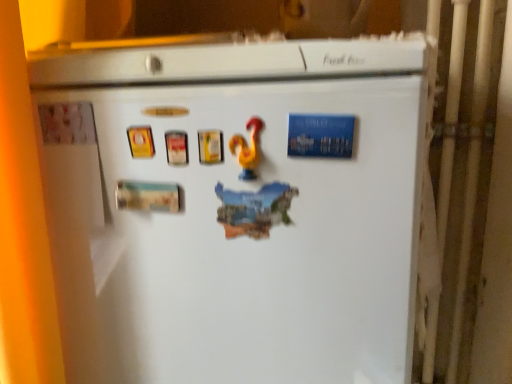
Question: Can you confirm if yellow rubber duck at center is wider than white matte refrigerator at center?

Choices:
 (A) yes
 (B) no

Answer: (B)

Question: Is yellow rubber duck at center facing towards white matte refrigerator at center?

Choices:
 (A) no
 (B) yes

Answer: (B)

Question: Can you see yellow rubber duck at center touching white matte refrigerator at center?

Choices:
 (A) yes
 (B) no

Answer: (B)

Question: Is yellow rubber duck at center positioned before white matte refrigerator at center?

Choices:
 (A) no
 (B) yes

Answer: (A)

Question: Is yellow rubber duck at center to the left of white matte refrigerator at center from the viewer's perspective?

Choices:
 (A) no
 (B) yes

Answer: (A)

Question: From the image's perspective, is yellow rubber duck at center located above white matte refrigerator at center?

Choices:
 (A) no
 (B) yes

Answer: (B)

Question: Is white matte refrigerator at center behind yellow rubber duck at center?

Choices:
 (A) no
 (B) yes

Answer: (A)

Question: From the image's perspective, is white matte refrigerator at center beneath yellow rubber duck at center?

Choices:
 (A) yes
 (B) no

Answer: (A)

Question: From the image's perspective, would you say white matte refrigerator at center is positioned over yellow rubber duck at center?

Choices:
 (A) no
 (B) yes

Answer: (A)

Question: Considering the relative positions of white matte refrigerator at center and yellow rubber duck at center in the image provided, is white matte refrigerator at center in front of yellow rubber duck at center?

Choices:
 (A) no
 (B) yes

Answer: (B)

Question: From a real-world perspective, is white matte refrigerator at center positioned under yellow rubber duck at center based on gravity?

Choices:
 (A) no
 (B) yes

Answer: (B)

Question: Is white matte refrigerator at center far from yellow rubber duck at center?

Choices:
 (A) yes
 (B) no

Answer: (B)

Question: Relative to white matte refrigerator at center, is yellow rubber duck at center in front or behind?

Choices:
 (A) behind
 (B) front

Answer: (A)